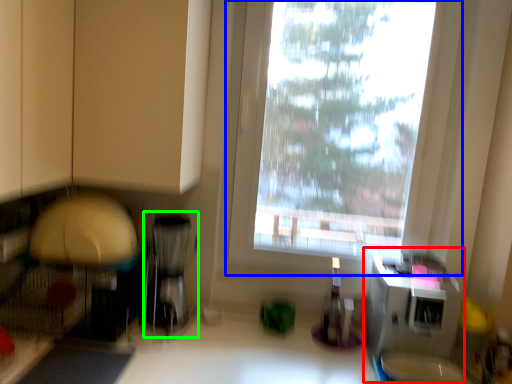
Question: Estimate the real-world distances between objects in this image. Which object is closer to appliance (highlighted by a red box), window (highlighted by a blue box) or appliance (highlighted by a green box)?

Choices:
 (A) window
 (B) appliance

Answer: (A)